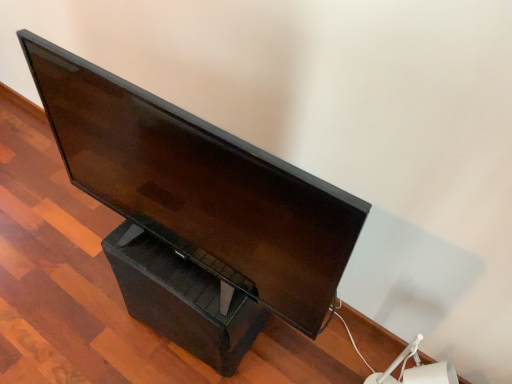
Question: Is black plastic drawer at lower center facing towards matte black monitor at center?

Choices:
 (A) no
 (B) yes

Answer: (A)

Question: Is black plastic drawer at lower center thinner than matte black monitor at center?

Choices:
 (A) yes
 (B) no

Answer: (B)

Question: Is the position of black plastic drawer at lower center less distant than that of matte black monitor at center?

Choices:
 (A) yes
 (B) no

Answer: (B)

Question: From the image's perspective, does black plastic drawer at lower center appear higher than matte black monitor at center?

Choices:
 (A) no
 (B) yes

Answer: (A)

Question: Does black plastic drawer at lower center come behind matte black monitor at center?

Choices:
 (A) no
 (B) yes

Answer: (B)

Question: Can you confirm if black plastic drawer at lower center is bigger than matte black monitor at center?

Choices:
 (A) no
 (B) yes

Answer: (A)

Question: From the image's perspective, is matte black monitor at center beneath black plastic drawer at lower center?

Choices:
 (A) yes
 (B) no

Answer: (B)

Question: Does matte black monitor at center appear on the right side of black plastic drawer at lower center?

Choices:
 (A) no
 (B) yes

Answer: (B)

Question: Considering the relative positions of matte black monitor at center and black plastic drawer at lower center in the image provided, is matte black monitor at center to the left of black plastic drawer at lower center from the viewer's perspective?

Choices:
 (A) no
 (B) yes

Answer: (A)

Question: From a real-world perspective, is matte black monitor at center beneath black plastic drawer at lower center?

Choices:
 (A) yes
 (B) no

Answer: (B)

Question: Is matte black monitor at center not inside black plastic drawer at lower center?

Choices:
 (A) no
 (B) yes

Answer: (B)

Question: Are matte black monitor at center and black plastic drawer at lower center far apart?

Choices:
 (A) no
 (B) yes

Answer: (A)

Question: In the image, is black plastic drawer at lower center positioned in front of or behind matte black monitor at center?

Choices:
 (A) behind
 (B) front

Answer: (A)